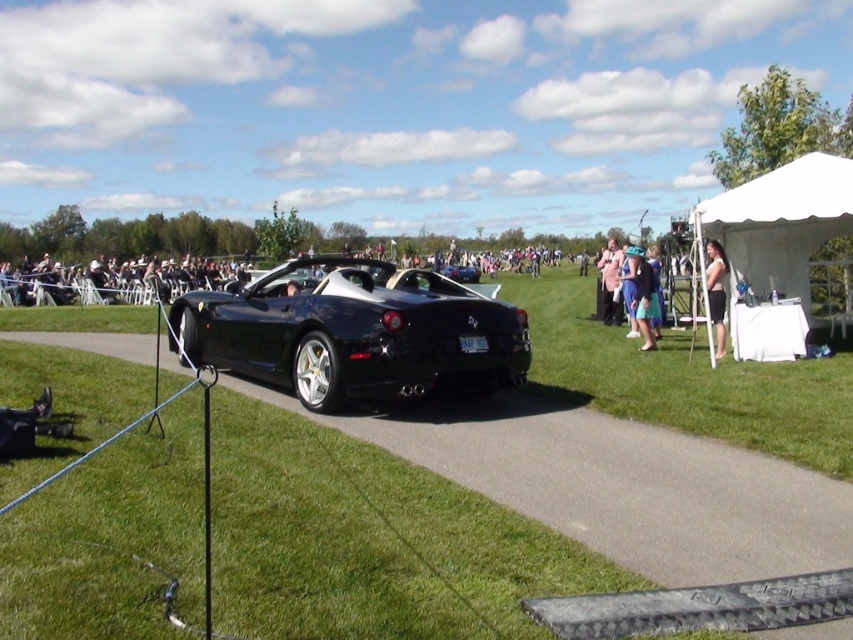
Question: Does white fabric tent at center right have a smaller size compared to pink fabric dress at center?

Choices:
 (A) no
 (B) yes

Answer: (A)

Question: Among these points, which one is farthest from the camera?

Choices:
 (A) [x=624, y=474]
 (B) [x=717, y=243]
 (C) [x=173, y=266]
 (D) [x=405, y=381]

Answer: (C)

Question: Which point is farther from the camera taking this photo?

Choices:
 (A) (608, 248)
 (B) (709, 253)
 (C) (631, 296)
 (D) (187, 317)

Answer: (A)

Question: Is white fabric tent at center right closer to the viewer compared to pink fabric dress at center?

Choices:
 (A) yes
 (B) no

Answer: (A)

Question: Which of the following is the farthest from the observer?

Choices:
 (A) (473, 282)
 (B) (207, 285)
 (C) (759, 204)
 (D) (734, 404)

Answer: (A)

Question: Does pink fabric dress at center appear on the right side of black matte convertible at center?

Choices:
 (A) yes
 (B) no

Answer: (A)